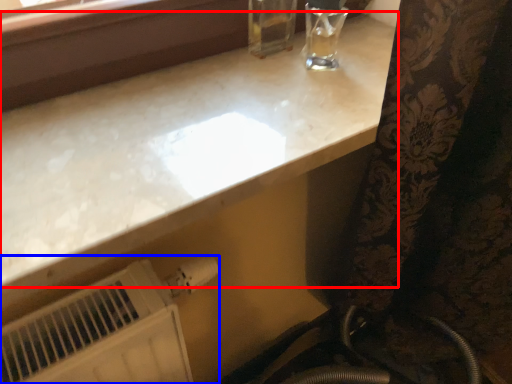
Question: Which of the following is the closest to the observer, countertop (highlighted by a red box) or water heater (highlighted by a blue box)?

Choices:
 (A) countertop
 (B) water heater

Answer: (A)